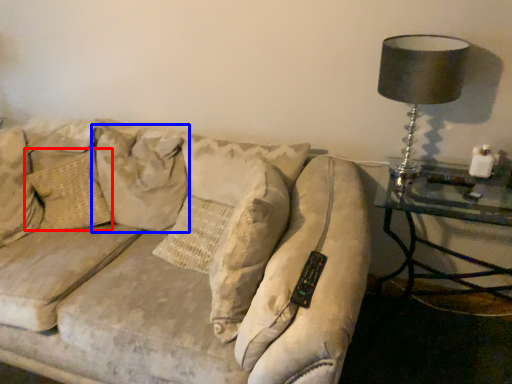
Question: Which of the following is the closest to the observer, pillow (highlighted by a red box) or pillow (highlighted by a blue box)?

Choices:
 (A) pillow
 (B) pillow

Answer: (B)